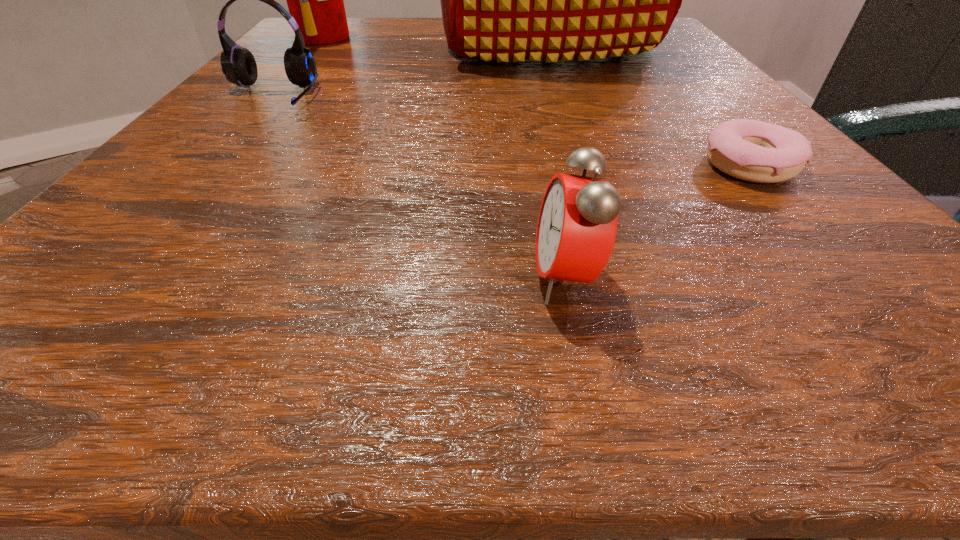
Find the location of a particular element. The image size is (960, 540). doughnut present at the right edge is located at coordinates (751, 150).

At what (x,y) coordinates should I click in order to perform the action: click on object that is positioned at the far left corner. Please return your answer as a coordinate pair (x, y). The width and height of the screenshot is (960, 540). Looking at the image, I should click on (315, 0).

Identify the location of object positioned at the far right corner. (502, 0).

What are the coordinates of `vacant space at the far edge` in the screenshot? It's located at (435, 28).

In the image, there is a desktop. Where is `free space at the near edge`? This screenshot has width=960, height=540. free space at the near edge is located at coordinates (601, 340).

This screenshot has width=960, height=540. I want to click on free space at the left edge of the desktop, so 224,239.

Find the location of a particular element. free space at the right edge of the desktop is located at coordinates (655, 58).

This screenshot has height=540, width=960. I want to click on vacant space at the far left corner of the desktop, so click(x=286, y=37).

The image size is (960, 540). What are the coordinates of `vacant space at the near right corner` in the screenshot? It's located at (893, 287).

Find the location of a particular element. Image resolution: width=960 pixels, height=540 pixels. empty location between the tallest object and the doughnut is located at coordinates (647, 107).